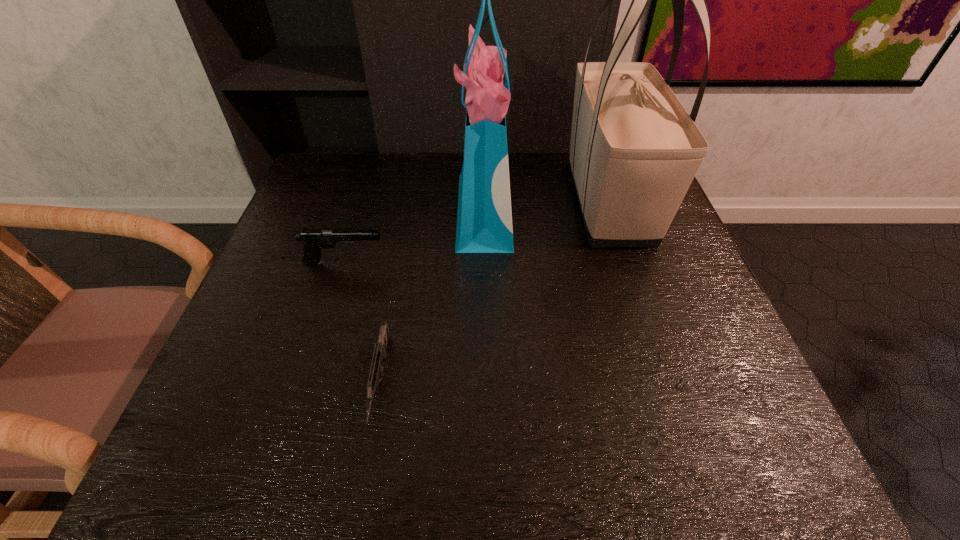
At what (x,y) coordinates should I click in order to perform the action: click on object present at the left edge. Please return your answer as a coordinate pair (x, y). Image resolution: width=960 pixels, height=540 pixels. Looking at the image, I should click on (314, 240).

At what (x,y) coordinates should I click in order to perform the action: click on object present at the right edge. Please return your answer as a coordinate pair (x, y). Looking at the image, I should click on (634, 151).

Identify the location of object that is at the far right corner. This screenshot has height=540, width=960. (634, 151).

In order to click on free location at the far edge of the desktop in this screenshot , I will do `click(418, 176)`.

Locate an element on the screen. vacant space at the near edge of the desktop is located at coordinates (320, 466).

Find the location of `vacant region at the left edge of the desktop`. vacant region at the left edge of the desktop is located at coordinates (327, 248).

In the image, there is a desktop. Identify the location of vacant space at the right edge. The width and height of the screenshot is (960, 540). (704, 304).

In order to click on free region at the far left corner in this screenshot , I will do `click(304, 198)`.

This screenshot has height=540, width=960. I want to click on free space between the left shopping bag and the second object from left to right, so pyautogui.click(x=432, y=297).

The image size is (960, 540). I want to click on free point between the third tallest object and the left shopping bag, so click(414, 237).